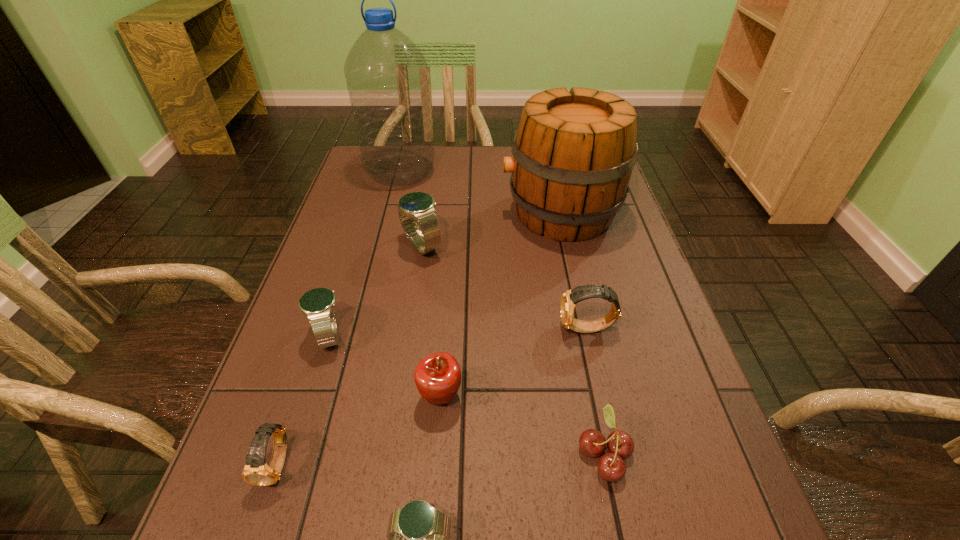
Find the location of `blue watch identified as the second closest to the second biggest blue watch`. blue watch identified as the second closest to the second biggest blue watch is located at coordinates (418, 535).

Identify which blue watch is the second closest to the nearest blue watch. Please provide its 2D coordinates. Your answer should be formatted as a tuple, i.e. [(x, y)], where the tuple contains the x and y coordinates of a point satisfying the conditions above.

[(417, 206)]

Image resolution: width=960 pixels, height=540 pixels. Identify the location of free space that satisfies the following two spatial constraints: 1. on the back side of the farthest blue watch; 2. on the right side of the second smallest blue watch. (358, 246).

Find the location of `free space that satisfies the following two spatial constraints: 1. on the face of the bigger gold watch; 2. on the front side of the apple`. free space that satisfies the following two spatial constraints: 1. on the face of the bigger gold watch; 2. on the front side of the apple is located at coordinates (602, 397).